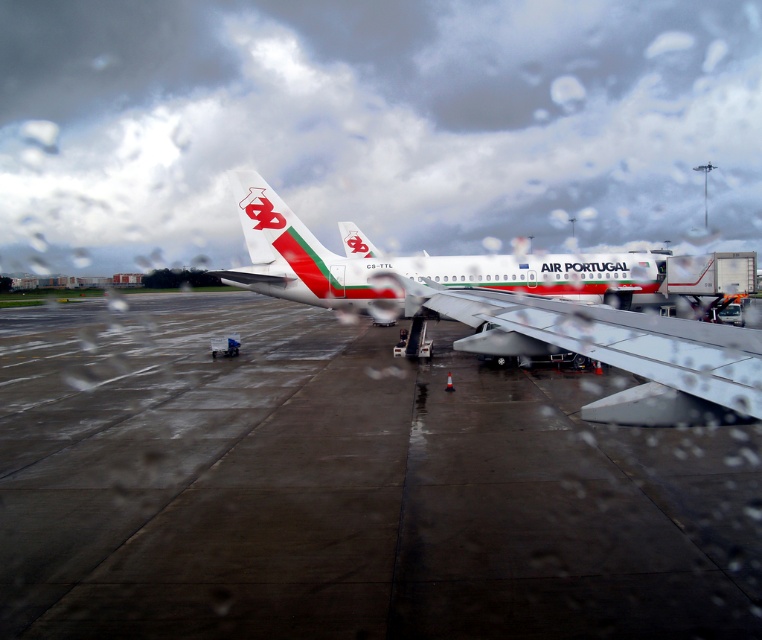
You are standing on the tarmac at the airport and see the Air Portugal aircraft with its red and green stripes. There is a point marked at coordinates (346, 486). What is located at that point?

The point at coordinates (346, 486) indicates concrete at center.

You are a maintenance worker at the airport. You need to move a 3.5 meter long ladder from the concrete at center to the white glossy airplane at center. Is there enough space between them to carry the ladder horizontally without tilting it?

The concrete at center and white glossy airplane at center are 4.06 meters apart from each other. Since the ladder is 3.5 meters long, there is sufficient space to carry it horizontally as the distance between them is greater than the ladder length.